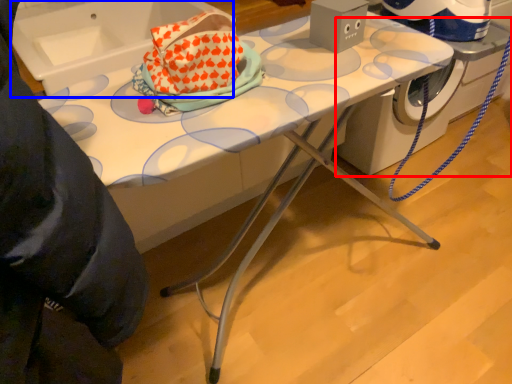
Question: Which of the following is the closest to the observer, machine (highlighted by a red box) or sink (highlighted by a blue box)?

Choices:
 (A) machine
 (B) sink

Answer: (B)